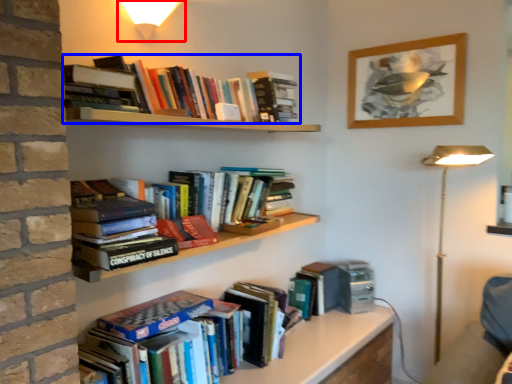
Question: Among these objects, which one is farthest to the camera, light fixture (highlighted by a red box) or book (highlighted by a blue box)?

Choices:
 (A) light fixture
 (B) book

Answer: (B)